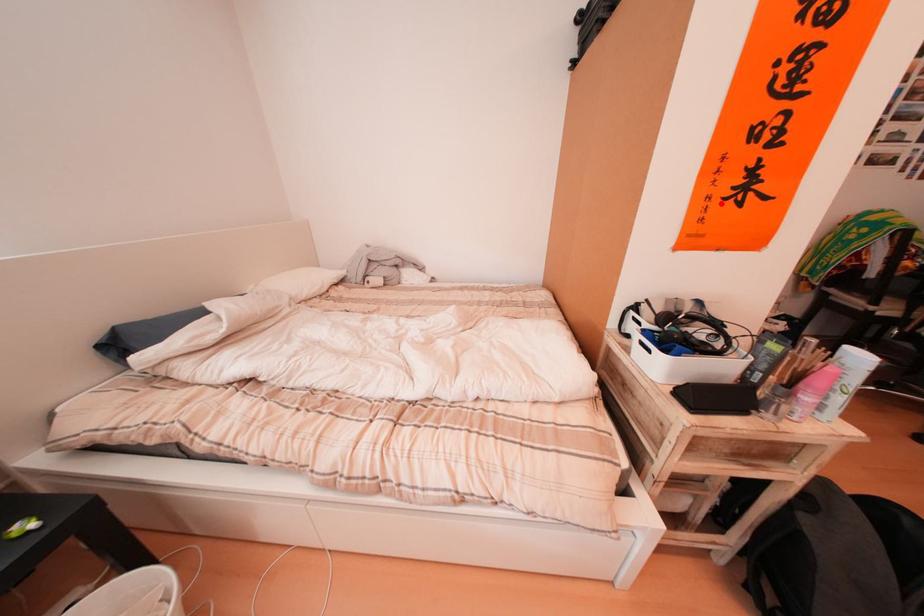
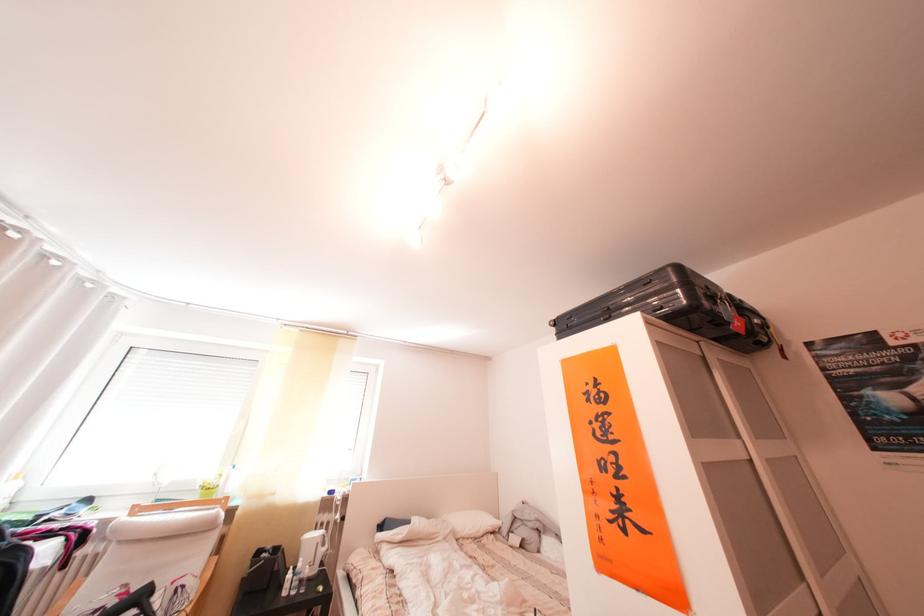
Find the pixel in the second image that matches the highlighted location in the first image.

(610, 522)